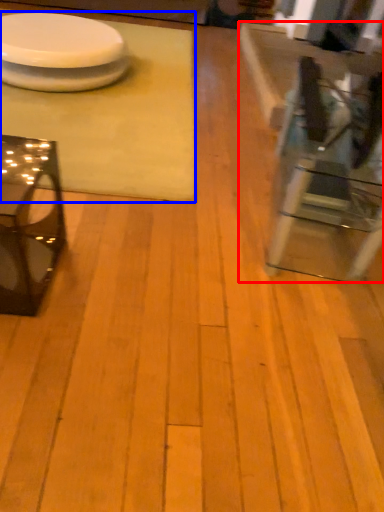
Question: Which object appears closest to the camera in this image, table (highlighted by a red box) or table (highlighted by a blue box)?

Choices:
 (A) table
 (B) table

Answer: (A)